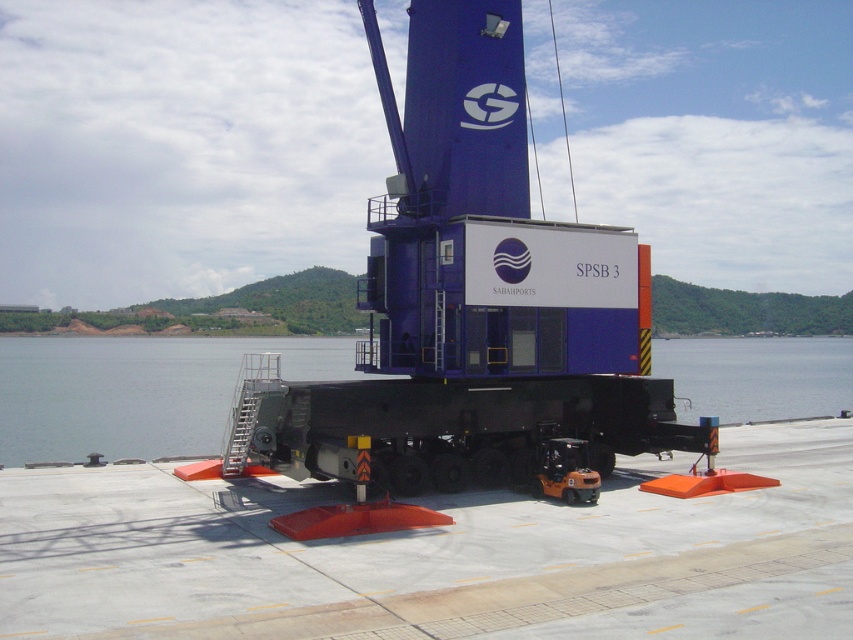
Question: Is concrete tarmac at center smaller than transparent water at center?

Choices:
 (A) yes
 (B) no

Answer: (A)

Question: Among these points, which one is farthest from the camera?

Choices:
 (A) (38, 442)
 (B) (805, 616)

Answer: (A)

Question: Is concrete tarmac at center to the right of transparent water at center from the viewer's perspective?

Choices:
 (A) no
 (B) yes

Answer: (B)

Question: Is concrete tarmac at center wider than transparent water at center?

Choices:
 (A) yes
 (B) no

Answer: (B)

Question: Among these points, which one is farthest from the camera?

Choices:
 (A) (30, 460)
 (B) (80, 572)

Answer: (A)